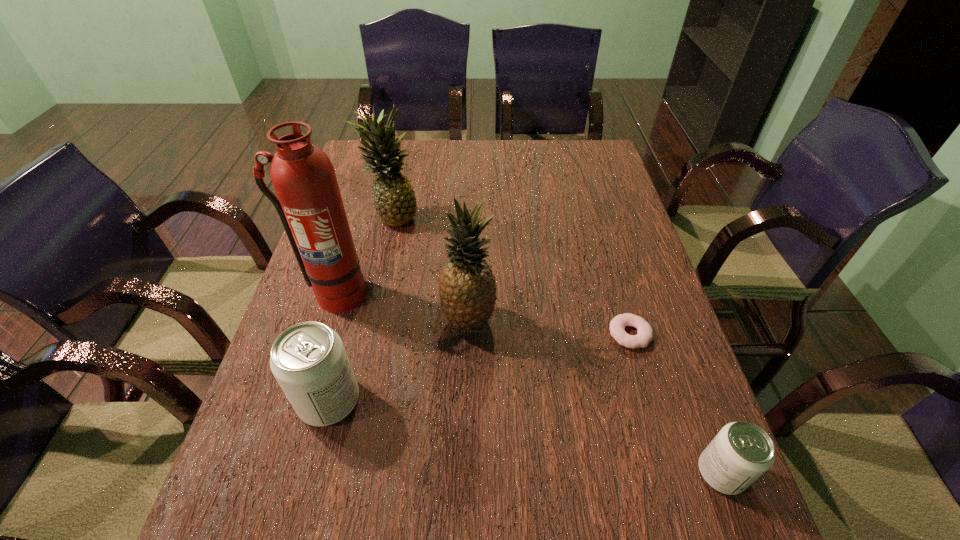
Image resolution: width=960 pixels, height=540 pixels. Identify the location of vacant region that satisfies the following two spatial constraints: 1. on the label side of the fifth tallest object; 2. on the left side of the tallest object. (280, 472).

Where is `vacant region that satisfies the following two spatial constraints: 1. on the label side of the nearer pineapple; 2. on the right side of the fire extinguisher`? The height and width of the screenshot is (540, 960). vacant region that satisfies the following two spatial constraints: 1. on the label side of the nearer pineapple; 2. on the right side of the fire extinguisher is located at coordinates (327, 320).

The height and width of the screenshot is (540, 960). I want to click on vacant space that satisfies the following two spatial constraints: 1. on the front side of the rightmost object; 2. on the right side of the fourth object from left to right, so click(465, 472).

Find the location of a particular element. The image size is (960, 540). vacant area that satisfies the following two spatial constraints: 1. on the back side of the left pineapple; 2. on the left side of the farther soda can is located at coordinates (377, 215).